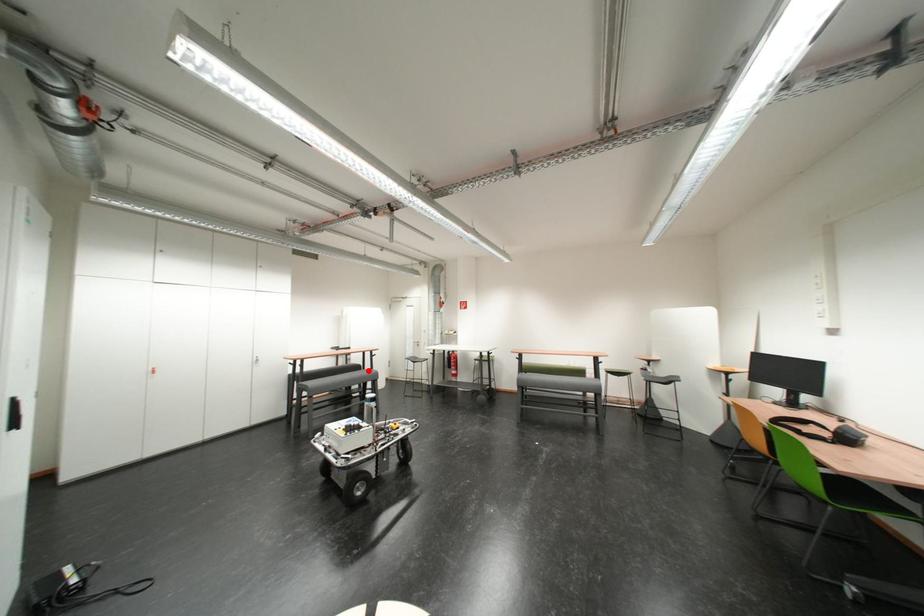
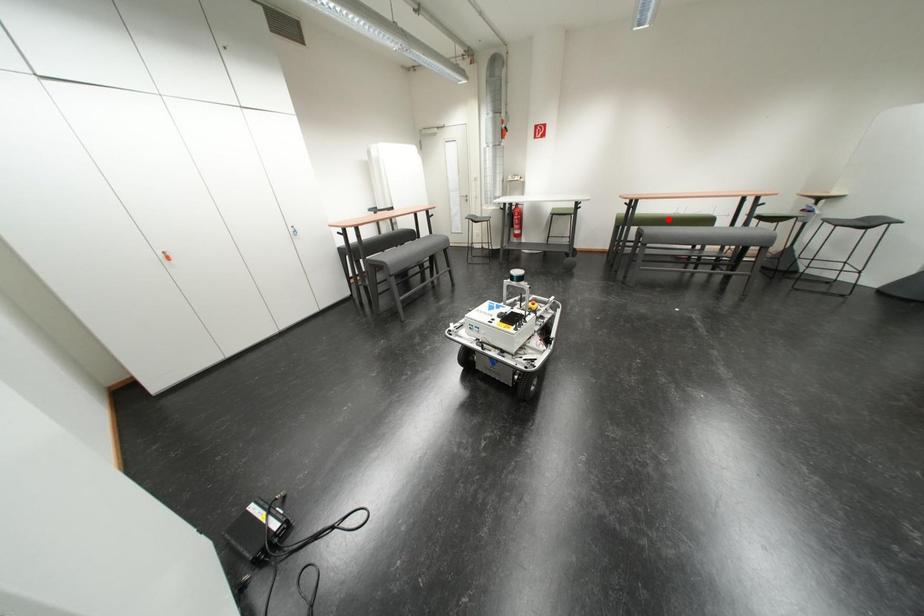
I am providing you with two images of the same scene from different viewpoints. A red point is marked on the first image and another point is marked on the second image. Do the highlighted points in image1 and image2 indicate the same real-world spot?

No